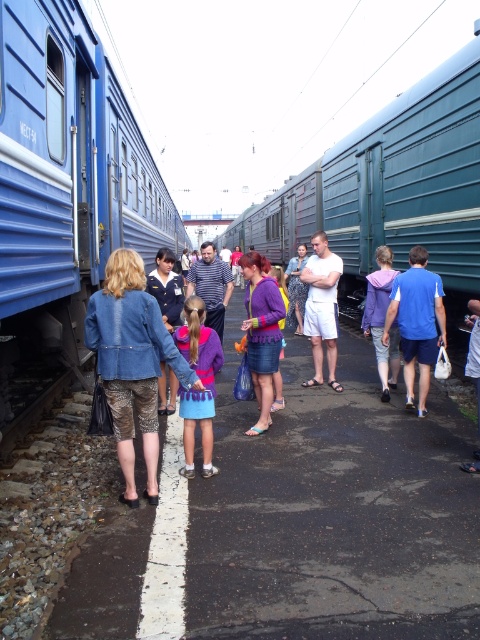
Question: Which point is farther to the camera?

Choices:
 (A) green metallic train at center
 (B) white cotton shorts at center
 (C) matte purple sweater at center

Answer: (B)

Question: Among these points, which one is nearest to the camera?

Choices:
 (A) (381, 381)
 (B) (454, 228)

Answer: (B)

Question: Can you confirm if denim jacket at center is smaller than blue fabric shirt at right?

Choices:
 (A) no
 (B) yes

Answer: (A)

Question: Considering the relative positions of blue painted metal train at left and blue fabric shirt at right in the image provided, where is blue painted metal train at left located with respect to blue fabric shirt at right?

Choices:
 (A) above
 (B) below

Answer: (A)

Question: Is white cotton shorts at center to the right of purple fleece jacket at center from the viewer's perspective?

Choices:
 (A) no
 (B) yes

Answer: (A)

Question: Which is nearer to the blue fabric shirt at right?

Choices:
 (A) denim jacket at center
 (B) white cotton shirt at center
 (C) purple matte sweater at center
 (D) green metallic train at center

Answer: (C)